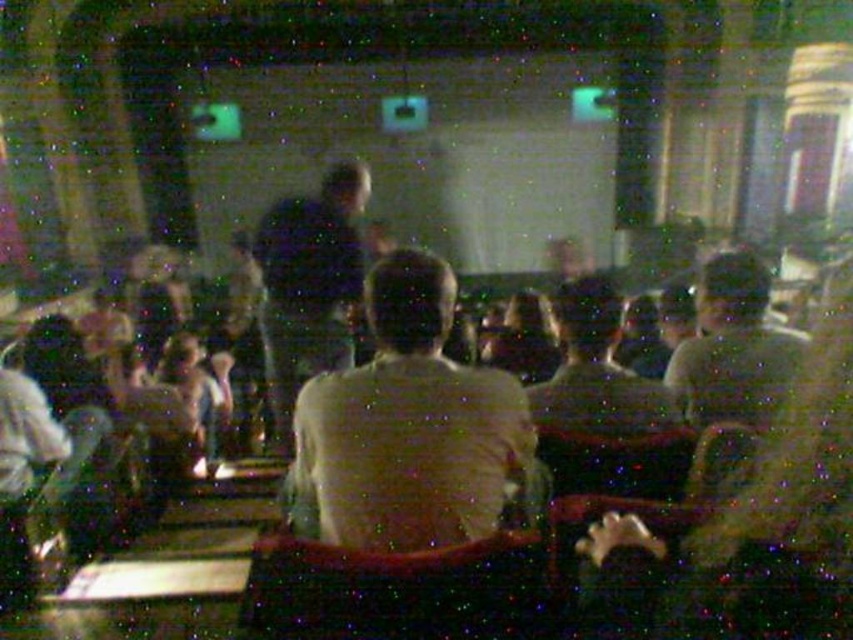
You are an event organizer who needs to place a 36 inch wide banner between the light brown shirt at center and the light brown leather jacket at center. Based on their positions, will the banner fit between them?

The light brown shirt at center and the light brown leather jacket at center are 37.59 inches apart, so the 36 inch wide banner will fit between them since the distance is greater than the banner width.

Based on the photo, you are sitting in the front row of the lecture hall and notice two points marked in the scene. The first point is at coordinates point (344, 442) and the second is at point (704, 262). Which point is closer to you?

Point (344, 442) is closer to the camera than point (704, 262), so the first point is closer to you.

You are organizing a photo shoot and need to ensure that the light brown shirt at center and the dark blue shirt at center are visible in the final image. Given that the camera can only capture objects up to the width of the narrower shirt, will both shirts be fully visible?

The light brown shirt at center is wider than the dark blue shirt at center. Since the camera can only capture up to the width of the narrower shirt, the light brown shirt at center may not be fully visible, while the dark blue shirt at center should fit within the camera capture range.